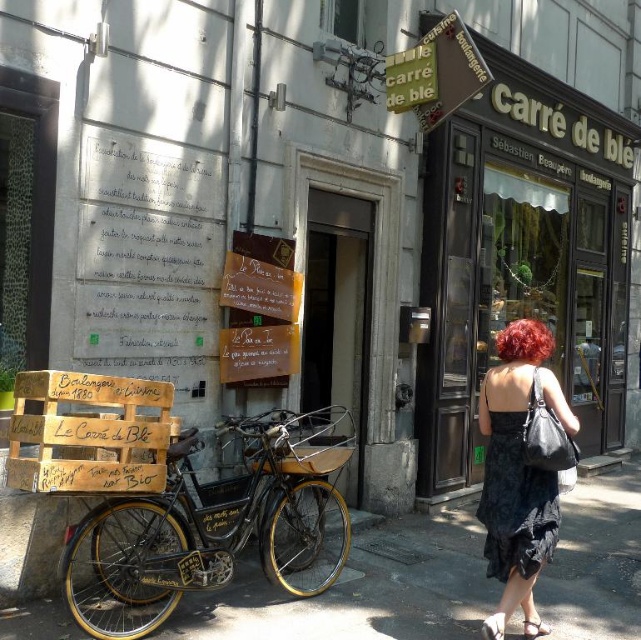
Question: Which point appears closest to the camera in this image?

Choices:
 (A) (221, 566)
 (B) (31, 477)

Answer: (B)

Question: Can you confirm if matte black storefront at center is positioned to the right of wooden crate at lower left?

Choices:
 (A) yes
 (B) no

Answer: (A)

Question: From the image, what is the correct spatial relationship of matte black storefront at center in relation to wooden crate at lower left?

Choices:
 (A) left
 (B) right

Answer: (B)

Question: Is rustic metal bicycle at center behind wooden crate at lower left?

Choices:
 (A) no
 (B) yes

Answer: (B)

Question: Which of the following is the farthest from the observer?

Choices:
 (A) (69, 413)
 (B) (544, 337)

Answer: (A)

Question: Which point is closer to the camera taking this photo?

Choices:
 (A) (535, 355)
 (B) (567, 355)
 (C) (497, 481)
 (D) (204, 547)

Answer: (C)